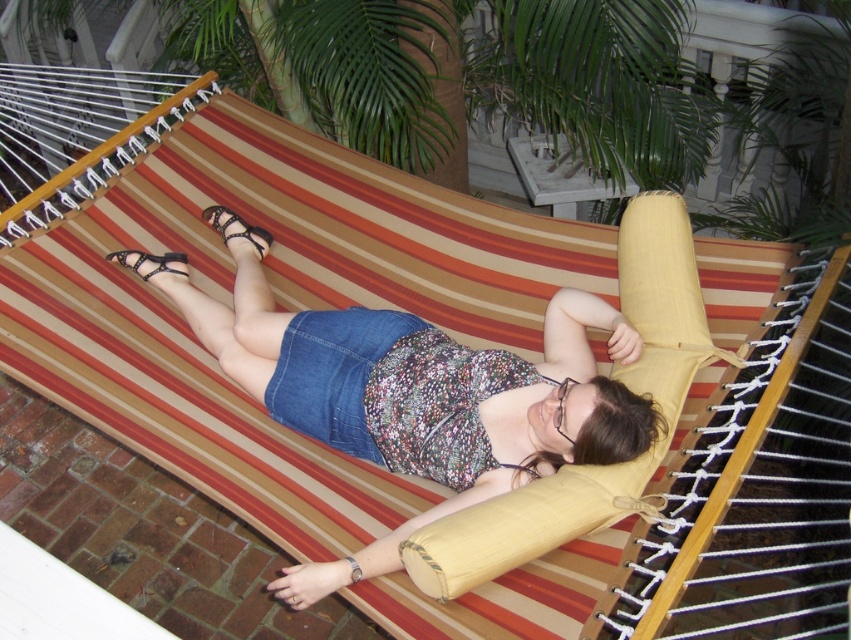
You are a delivery robot that needs to place a small package between the denim skirt at center and the black leather sandal at lower left. Can you fit it there if the package is 24 inches long?

The denim skirt at center and black leather sandal at lower left are 26.22 inches apart from each other. Since the package is 24 inches long, which is shorter than the distance between them, the robot can fit the package between the denim skirt at center and the black leather sandal at lower left.

You are a shoemaker examining two black leather sandals in the image. The first is labeled as the black leather sandal at center, and the second is the black leather sandal at lower left. Which sandal has a narrower width?

The black leather sandal at center has a lesser width compared to the black leather sandal at lower left, so the sandal at center is narrower.

You are a photographer trying to capture the perfect shot of the scene. You need to focus on the denim skirt at center. What are the coordinates where you should aim your camera?

The denim skirt at center is located at coordinates point (523, 435).